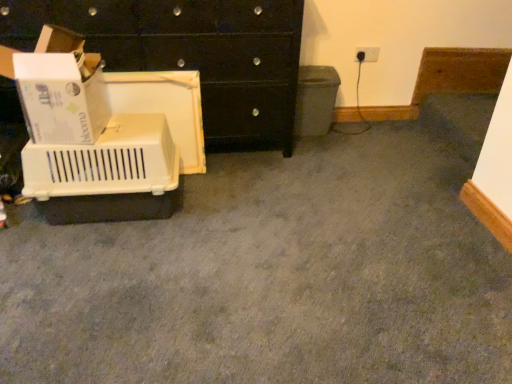
Question: Is beige plastic crate at left positioned before white cardboard box at left?

Choices:
 (A) no
 (B) yes

Answer: (A)

Question: Considering the relative sizes of beige plastic crate at left and white cardboard box at left in the image provided, is beige plastic crate at left taller than white cardboard box at left?

Choices:
 (A) no
 (B) yes

Answer: (B)

Question: Is beige plastic crate at left shorter than white cardboard box at left?

Choices:
 (A) yes
 (B) no

Answer: (B)

Question: Considering the relative sizes of beige plastic crate at left and white cardboard box at left in the image provided, is beige plastic crate at left wider than white cardboard box at left?

Choices:
 (A) no
 (B) yes

Answer: (B)

Question: Does beige plastic crate at left have a lesser width compared to white cardboard box at left?

Choices:
 (A) yes
 (B) no

Answer: (B)

Question: Is matte gray recycling bin at center-right taller or shorter than white cardboard box at left?

Choices:
 (A) tall
 (B) short

Answer: (A)

Question: From a real-world perspective, is matte gray recycling bin at center-right physically located above or below white cardboard box at left?

Choices:
 (A) below
 (B) above

Answer: (A)

Question: Considering the positions of matte gray recycling bin at center-right and white cardboard box at left in the image, is matte gray recycling bin at center-right bigger or smaller than white cardboard box at left?

Choices:
 (A) big
 (B) small

Answer: (B)

Question: Considering their positions, is matte gray recycling bin at center-right located in front of or behind white cardboard box at left?

Choices:
 (A) front
 (B) behind

Answer: (B)

Question: Is point (313, 99) positioned closer to the camera than point (163, 180)?

Choices:
 (A) closer
 (B) farther

Answer: (B)

Question: In terms of height, does matte gray recycling bin at center-right look taller or shorter compared to beige plastic crate at left?

Choices:
 (A) tall
 (B) short

Answer: (A)

Question: In the image, is matte gray recycling bin at center-right positioned in front of or behind beige plastic crate at left?

Choices:
 (A) behind
 (B) front

Answer: (A)

Question: From the image's perspective, relative to beige plastic crate at left, is matte gray recycling bin at center-right above or below?

Choices:
 (A) below
 (B) above

Answer: (B)

Question: From the image's perspective, relative to white plastic electric outlet at upper right, is beige plastic crate at left above or below?

Choices:
 (A) below
 (B) above

Answer: (A)

Question: From a real-world perspective, relative to white plastic electric outlet at upper right, is beige plastic crate at left vertically above or below?

Choices:
 (A) above
 (B) below

Answer: (B)